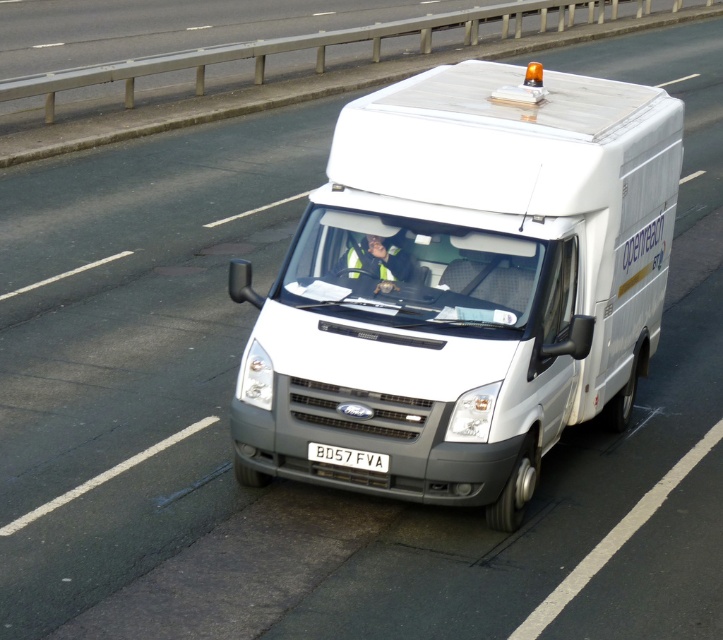
You are a pedestrian standing on the sidewalk and looking at the white matte van at center and the white plastic license plate at center. Which object is higher from the ground?

The white matte van at center is above the white plastic license plate at center, so the white matte van at center is higher from the ground.

You are a pedestrian standing on the sidewalk. You see a white matte van at center and a white plastic license plate at center. Which object is closer to the right side of the road?

The white matte van at center is to the right of the white plastic license plate at center, so the van is closer to the right side of the road.